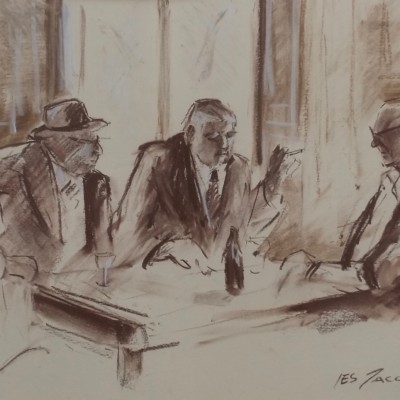
Find the location of a particular element. curtains is located at coordinates (326, 62).